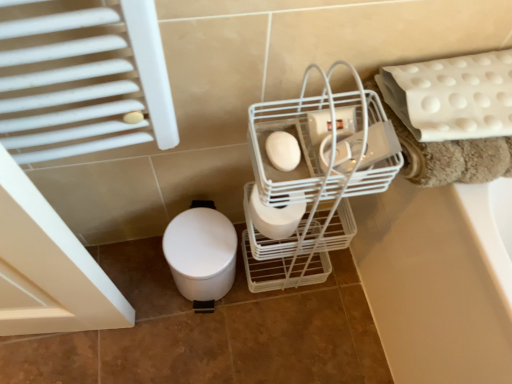
This screenshot has height=384, width=512. What do you see at coordinates (274, 217) in the screenshot? I see `white matte toilet paper at center, the 2th toilet paper viewed from the front` at bounding box center [274, 217].

What do you see at coordinates (314, 180) in the screenshot? I see `white wire basket at center` at bounding box center [314, 180].

This screenshot has height=384, width=512. I want to click on white matte toilet paper at center, marked as the 2th toilet paper in a top-to-bottom arrangement, so click(x=274, y=217).

Considering the sizes of objects white wire basket at center and white matte toilet paper at center, marked as the 2th toilet paper in a top-to-bottom arrangement, in the image provided, who is wider, white wire basket at center or white matte toilet paper at center, marked as the 2th toilet paper in a top-to-bottom arrangement,?

white wire basket at center.

From a real-world perspective, is white wire basket at center on top of white matte toilet paper at center, marked as the 2th toilet paper in a top-to-bottom arrangement?

Yes, from a real-world perspective, white wire basket at center is over white matte toilet paper at center, marked as the 2th toilet paper in a top-to-bottom arrangement

Considering the relative sizes of white wire basket at center and white matte toilet paper at center, the first toilet paper viewed from the back, in the image provided, is white wire basket at center shorter than white matte toilet paper at center, the first toilet paper viewed from the back,?

Incorrect, the height of white wire basket at center does not fall short of that of white matte toilet paper at center, the first toilet paper viewed from the back.

Is white wire basket at center positioned far away from white matte toilet paper at center, the 2th toilet paper viewed from the front?

white wire basket at center is actually quite close to white matte toilet paper at center, the 2th toilet paper viewed from the front.

Measure the distance between white matte toilet paper at center, the 2th toilet paper viewed from the front, and white matte toilet paper at center, the first toilet paper viewed from the top.

They are 16.12 centimeters apart.

Considering the relative positions of white matte toilet paper at center, which is the first toilet paper in bottom-to-top order, and white matte toilet paper at center, positioned as the 1th toilet paper in front-to-back order, in the image provided, is white matte toilet paper at center, which is the first toilet paper in bottom-to-top order, in front of white matte toilet paper at center, positioned as the 1th toilet paper in front-to-back order,?

No, it is not.

Can you confirm if white matte toilet paper at center, the 2th toilet paper viewed from the front, is positioned to the left of white matte toilet paper at center, the first toilet paper viewed from the top?

In fact, white matte toilet paper at center, the 2th toilet paper viewed from the front, is to the right of white matte toilet paper at center, the first toilet paper viewed from the top.

From the image's perspective, is white matte toilet paper at center, the first toilet paper viewed from the back, located above or below white matte toilet paper at center, the 2th toilet paper when ordered from bottom to top?

Clearly, from the image's perspective, white matte toilet paper at center, the first toilet paper viewed from the back, is below white matte toilet paper at center, the 2th toilet paper when ordered from bottom to top.

Does white matte toilet at lower left have a smaller size compared to white matte toilet paper at center, the 2th toilet paper when ordered from bottom to top?

No, white matte toilet at lower left is not smaller than white matte toilet paper at center, the 2th toilet paper when ordered from bottom to top.

Who is shorter, white matte toilet at lower left or white matte toilet paper at center, the first toilet paper viewed from the top?

Standing shorter between the two is white matte toilet paper at center, the first toilet paper viewed from the top.

Which object is positioned more to the right, white matte toilet at lower left or white matte toilet paper at center, which is the second toilet paper from back to front?

From the viewer's perspective, white matte toilet paper at center, which is the second toilet paper from back to front, appears more on the right side.

Considering the positions of points (185, 285) and (281, 160), is point (185, 285) farther from camera compared to point (281, 160)?

That is True.

Is white matte toilet paper at center, the first toilet paper viewed from the back, looking in the opposite direction of white matte toilet at lower left?

No, white matte toilet paper at center, the first toilet paper viewed from the back,'s orientation is not away from white matte toilet at lower left.

Is white matte toilet paper at center, marked as the 2th toilet paper in a top-to-bottom arrangement, positioned far away from white matte toilet at lower left?

No, there isn't a large distance between white matte toilet paper at center, marked as the 2th toilet paper in a top-to-bottom arrangement, and white matte toilet at lower left.

In terms of height, does white matte toilet paper at center, the first toilet paper viewed from the back, look taller or shorter compared to white matte toilet at lower left?

Clearly, white matte toilet paper at center, the first toilet paper viewed from the back, is shorter compared to white matte toilet at lower left.

Looking at this image, looking at their sizes, would you say white matte toilet paper at center, the 2th toilet paper viewed from the front, is wider or thinner than white matte toilet at lower left?

white matte toilet paper at center, the 2th toilet paper viewed from the front, is thinner than white matte toilet at lower left.

Considering the sizes of objects white matte toilet paper at center, the 2th toilet paper when ordered from bottom to top, and white matte toilet paper at center, marked as the 2th toilet paper in a top-to-bottom arrangement, in the image provided, who is taller, white matte toilet paper at center, the 2th toilet paper when ordered from bottom to top, or white matte toilet paper at center, marked as the 2th toilet paper in a top-to-bottom arrangement,?

Standing taller between the two is white matte toilet paper at center, marked as the 2th toilet paper in a top-to-bottom arrangement.

In the scene shown: Which object is positioned more to the right, white matte toilet paper at center, positioned as the 1th toilet paper in front-to-back order, or white matte toilet paper at center, which is the first toilet paper in bottom-to-top order?

From the viewer's perspective, white matte toilet paper at center, which is the first toilet paper in bottom-to-top order, appears more on the right side.

Is white matte toilet paper at center, positioned as the 1th toilet paper in front-to-back order, bigger than white matte toilet paper at center, the first toilet paper viewed from the back?

Actually, white matte toilet paper at center, positioned as the 1th toilet paper in front-to-back order, might be smaller than white matte toilet paper at center, the first toilet paper viewed from the back.

Is white matte toilet paper at center, which is the second toilet paper from back to front, in front of white matte toilet paper at center, the first toilet paper viewed from the back?

Yes, white matte toilet paper at center, which is the second toilet paper from back to front, is closer to the camera.

The width and height of the screenshot is (512, 384). I want to click on trolley positioned vertically above the white matte toilet paper at center, which is the first toilet paper in bottom-to-top order (from a real-world perspective), so click(x=314, y=180).

Would you say white matte toilet paper at center, the first toilet paper viewed from the back, is to the left or to the right of white wire basket at center in the picture?

white matte toilet paper at center, the first toilet paper viewed from the back, is to the left of white wire basket at center.

Are white matte toilet paper at center, the first toilet paper viewed from the back, and white wire basket at center making contact?

white matte toilet paper at center, the first toilet paper viewed from the back, and white wire basket at center are not in contact.

Which of these two, white matte toilet at lower left or white wire basket at center, is thinner?

white wire basket at center.

From a real-world perspective, between white matte toilet at lower left and white wire basket at center, who is vertically lower?

white matte toilet at lower left.

Can you tell me how much white matte toilet at lower left and white wire basket at center differ in facing direction?

The angular difference between white matte toilet at lower left and white wire basket at center is 0.517 degrees.

From the image's perspective, relative to white wire basket at center, is white matte toilet at lower left above or below?

white matte toilet at lower left is situated lower than white wire basket at center in the image.

Where is `toilet paper below the white wire basket at center (from a real-world perspective)`? The height and width of the screenshot is (384, 512). toilet paper below the white wire basket at center (from a real-world perspective) is located at coordinates (274, 217).

Where is `toilet paper located in front of the white matte toilet paper at center, the 2th toilet paper viewed from the front`? The height and width of the screenshot is (384, 512). toilet paper located in front of the white matte toilet paper at center, the 2th toilet paper viewed from the front is located at coordinates (283, 151).

From the image, which object appears to be farther from white matte toilet paper at center, marked as the 2th toilet paper in a top-to-bottom arrangement, white matte toilet paper at center, positioned as the 1th toilet paper in front-to-back order, or white wire basket at center?

The object further to white matte toilet paper at center, marked as the 2th toilet paper in a top-to-bottom arrangement, is white matte toilet paper at center, positioned as the 1th toilet paper in front-to-back order.

Which object lies further to the anchor point white matte toilet paper at center, positioned as the 1th toilet paper in front-to-back order, white wire basket at center or white matte toilet paper at center, marked as the 2th toilet paper in a top-to-bottom arrangement?

white wire basket at center is positioned further to the anchor white matte toilet paper at center, positioned as the 1th toilet paper in front-to-back order.

Considering their positions, is white matte toilet paper at center, the 2th toilet paper when ordered from bottom to top, positioned further to white wire basket at center than white matte toilet paper at center, the first toilet paper viewed from the back?

white matte toilet paper at center, the 2th toilet paper when ordered from bottom to top, is further to white wire basket at center.

From the image, which object appears to be farther from white matte toilet paper at center, positioned as the 1th toilet paper in front-to-back order, white matte toilet paper at center, the first toilet paper viewed from the back, or white wire basket at center?

white wire basket at center.

Looking at this image, considering their positions, is white wire basket at center positioned closer to white matte toilet paper at center, the 2th toilet paper viewed from the front, than white matte toilet paper at center, the 2th toilet paper when ordered from bottom to top?

The object closer to white matte toilet paper at center, the 2th toilet paper viewed from the front, is white wire basket at center.

Considering their positions, is white matte toilet paper at center, the 2th toilet paper viewed from the front, positioned closer to white wire basket at center than white matte toilet at lower left?

white matte toilet paper at center, the 2th toilet paper viewed from the front, is positioned closer to the anchor white wire basket at center.

Based on their spatial positions, is white matte toilet at lower left or white matte toilet paper at center, the first toilet paper viewed from the back, further from white wire basket at center?

The object further to white wire basket at center is white matte toilet at lower left.

Estimate the real-world distances between objects in this image. Which object is further from white matte toilet at lower left, white matte toilet paper at center, marked as the 2th toilet paper in a top-to-bottom arrangement, or white wire basket at center?

The object further to white matte toilet at lower left is white wire basket at center.

The image size is (512, 384). What are the coordinates of `toilet paper between white matte toilet paper at center, which is the second toilet paper from back to front, and white matte toilet at lower left vertically` in the screenshot? It's located at [274, 217].

Where is `toilet paper positioned between white wire basket at center and white matte toilet paper at center, marked as the 2th toilet paper in a top-to-bottom arrangement, from near to far`? The height and width of the screenshot is (384, 512). toilet paper positioned between white wire basket at center and white matte toilet paper at center, marked as the 2th toilet paper in a top-to-bottom arrangement, from near to far is located at coordinates (283, 151).